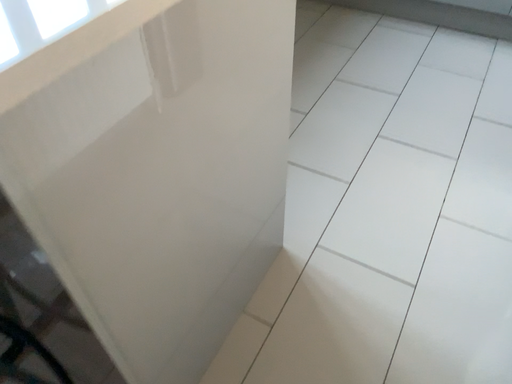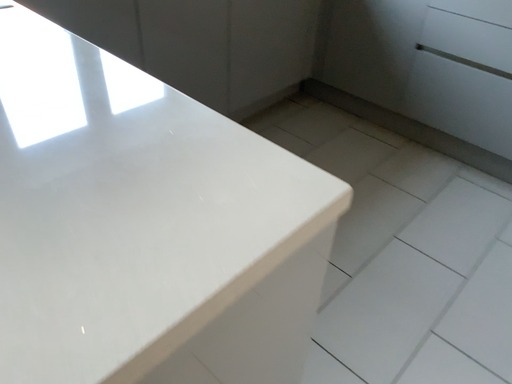
Question: Which way did the camera rotate in the video?

Choices:
 (A) rotated downward
 (B) rotated upward

Answer: (B)